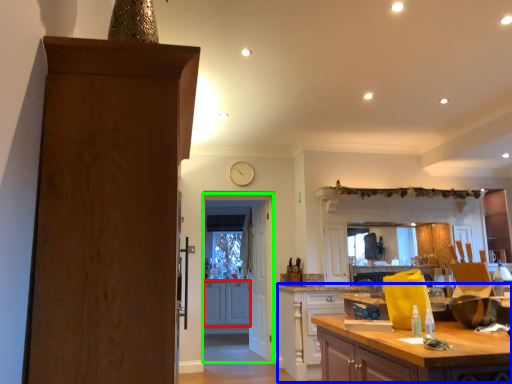
Question: Which object is positioned closest to cabinetry (highlighted by a red box)? Select from cabinetry (highlighted by a blue box) and door (highlighted by a green box).

Choices:
 (A) cabinetry
 (B) door

Answer: (B)